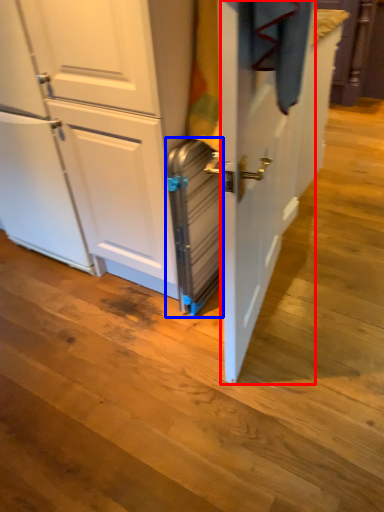
Question: Which object is further to the camera taking this photo, screen door (highlighted by a red box) or appliance (highlighted by a blue box)?

Choices:
 (A) screen door
 (B) appliance

Answer: (B)